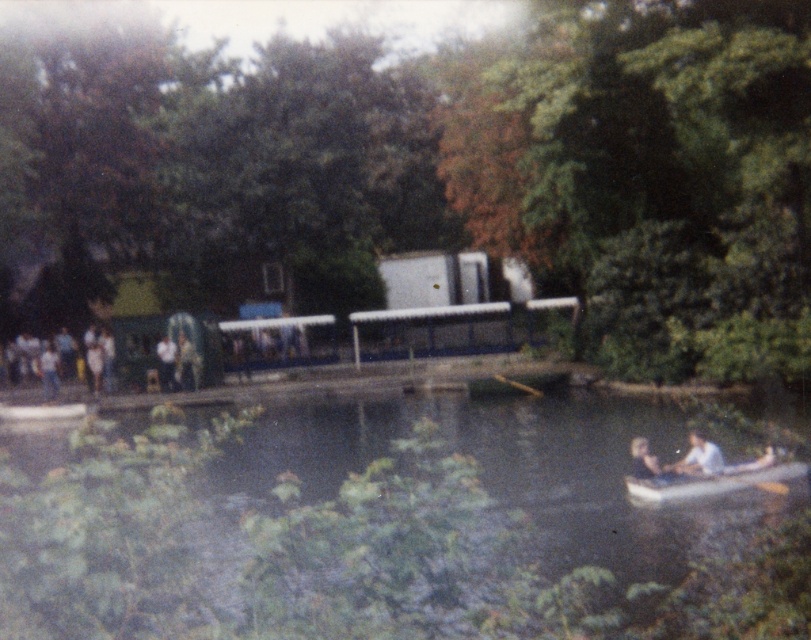
You are planning to store the wooden paddle at lower right and the light brown wooden paddle boat at lower right in a storage compartment. Based on their sizes, which one can fit into a smaller storage compartment?

The wooden paddle at lower right occupies less space than the light brown wooden paddle boat at lower right, so the wooden paddle at lower right can fit into a smaller storage compartment.

You are a photographer trying to capture the white plastic boat at lower right and the wooden paddle at lower right in the same frame. Which object should you position closer to the left side of your camera viewfinder to include both in the shot?

The white plastic boat at lower right is positioned on the left side of wooden paddle at lower right. To include both in the shot, position the white plastic boat at lower right closer to the left side of the camera viewfinder so that the wooden paddle at lower right is on its right side.

You are planning to use the wooden paddle at lower right to move the white plastic boat at lower right. Based on their sizes, do you think the paddle will be long enough to effectively maneuver the boat?

The white plastic boat at lower right is larger than the wooden paddle at lower right. Since the paddle is shorter than the boat, it may not provide sufficient leverage or reach to effectively maneuver the boat.